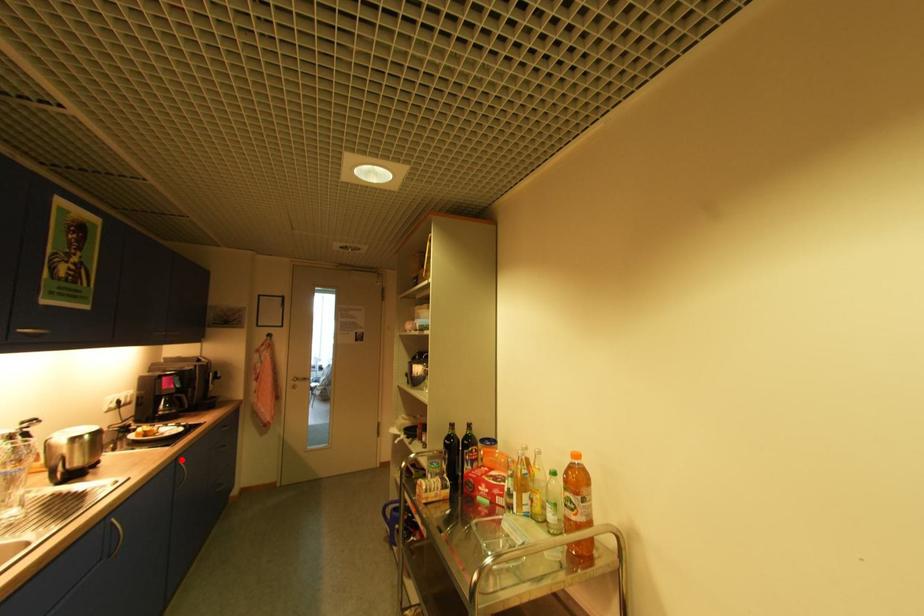
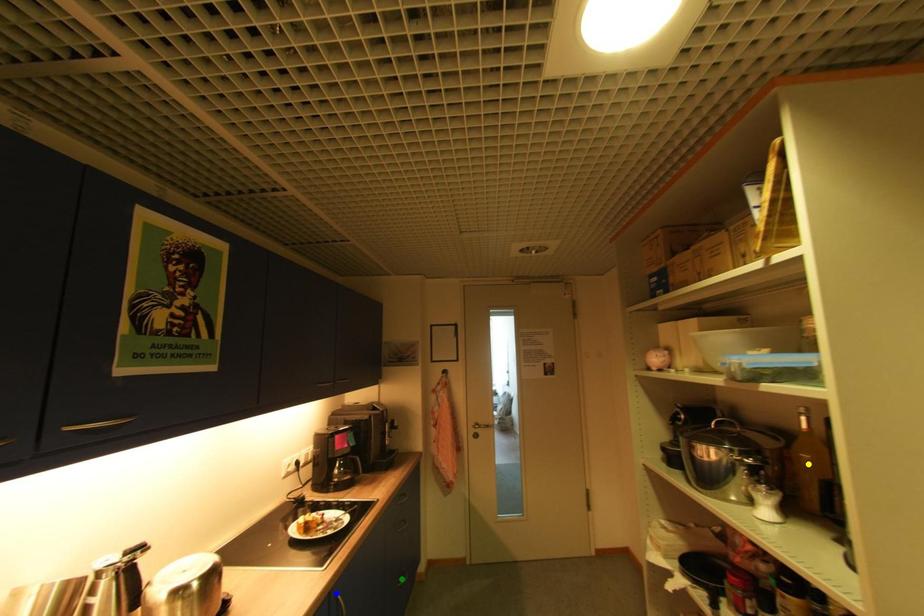
Question: I am providing you with two images of the same scene from different viewpoints. A red point is marked on the first image. You are given multiple points on the second image. Which spot in image 2 lines up with the point in image 1?

Choices:
 (A) blue point
 (B) green point
 (C) yellow point

Answer: (A)